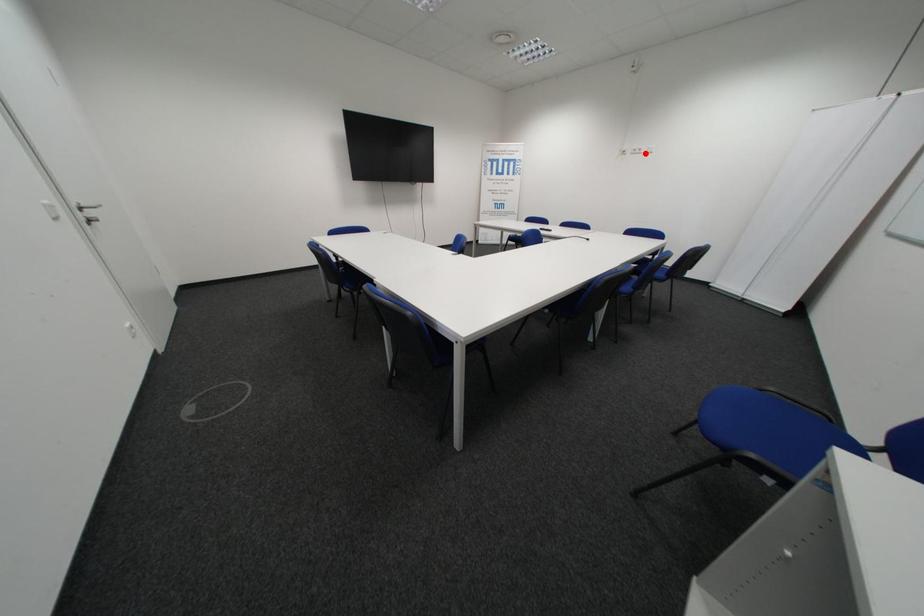
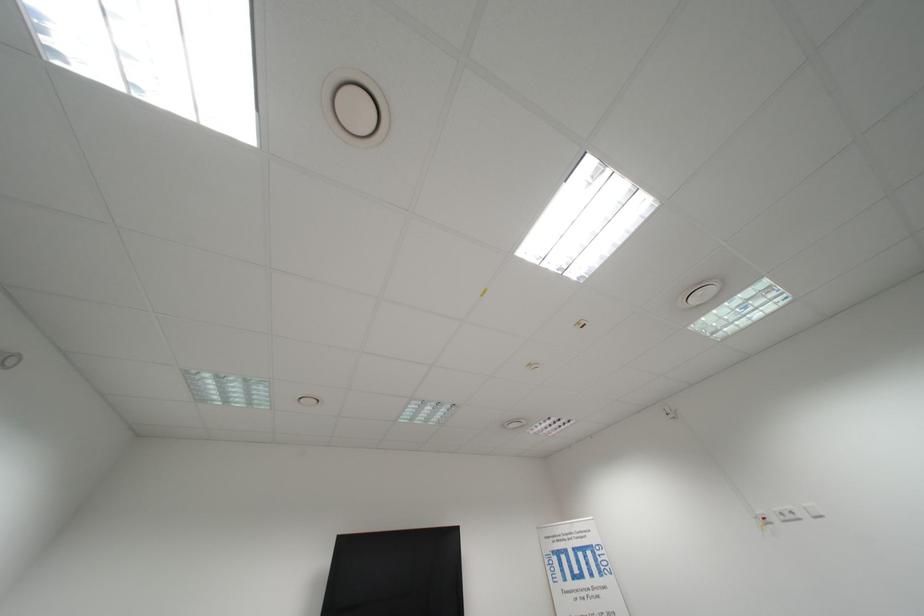
In the second image, find the point that corresponds to the highlighted location in the first image.

(796, 519)